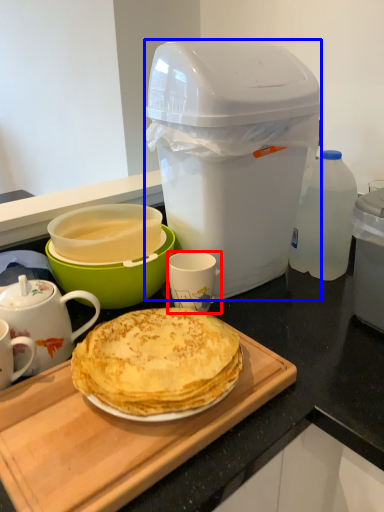
Question: Which point is further to the camera, coffee cup (highlighted by a red box) or trash bin/can (highlighted by a blue box)?

Choices:
 (A) coffee cup
 (B) trash bin/can

Answer: (A)